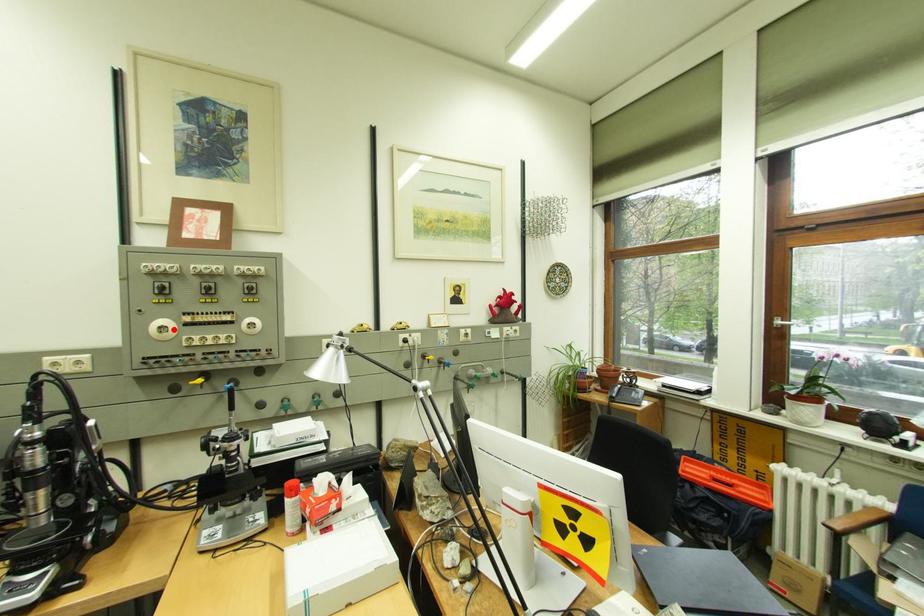
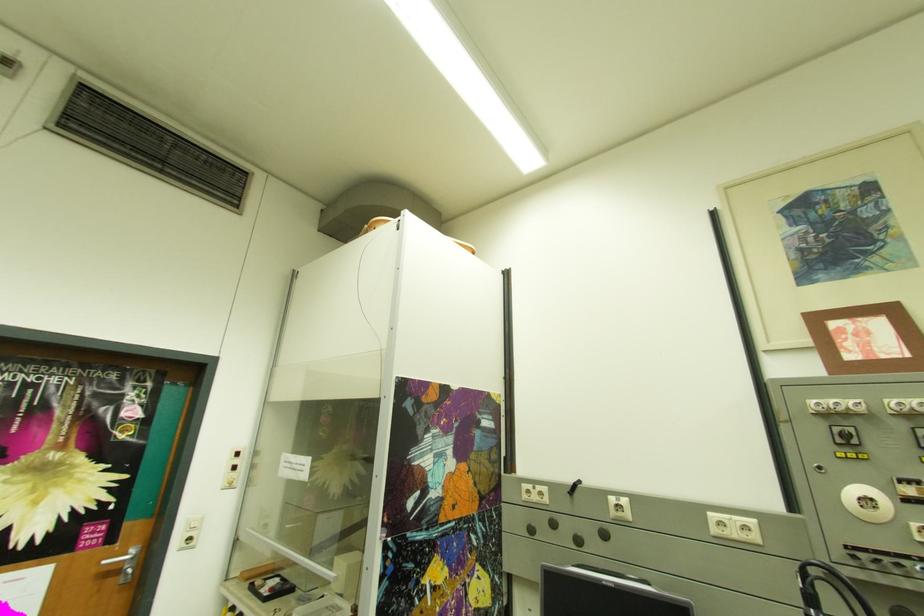
In the second image, find the point that corresponds to the highlighted location in the first image.

(878, 501)